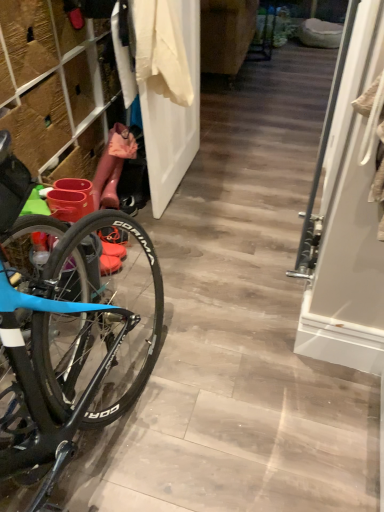
Question: Is white glossy screen door at right at the right side of rubber boots at left?

Choices:
 (A) yes
 (B) no

Answer: (A)

Question: Is white glossy screen door at right far away from rubber boots at left?

Choices:
 (A) no
 (B) yes

Answer: (B)

Question: Considering the relative sizes of white glossy screen door at right and rubber boots at left in the image provided, is white glossy screen door at right thinner than rubber boots at left?

Choices:
 (A) yes
 (B) no

Answer: (A)

Question: Is rubber boots at left at the back of white glossy screen door at right?

Choices:
 (A) no
 (B) yes

Answer: (A)

Question: Does white glossy screen door at right turn towards rubber boots at left?

Choices:
 (A) no
 (B) yes

Answer: (B)

Question: Is the depth of white glossy screen door at right less than that of rubber boots at left?

Choices:
 (A) yes
 (B) no

Answer: (A)

Question: From the image's perspective, is white matte door at center on rubber boots at left?

Choices:
 (A) yes
 (B) no

Answer: (A)

Question: Is white matte door at center bigger than rubber boots at left?

Choices:
 (A) no
 (B) yes

Answer: (A)

Question: Considering the relative sizes of white matte door at center and rubber boots at left in the image provided, is white matte door at center smaller than rubber boots at left?

Choices:
 (A) no
 (B) yes

Answer: (B)

Question: Considering the relative positions of white matte door at center and rubber boots at left in the image provided, is white matte door at center to the left of rubber boots at left from the viewer's perspective?

Choices:
 (A) yes
 (B) no

Answer: (B)

Question: Is white matte door at center further to camera compared to rubber boots at left?

Choices:
 (A) yes
 (B) no

Answer: (A)

Question: Is white matte door at center positioned far away from rubber boots at left?

Choices:
 (A) yes
 (B) no

Answer: (B)

Question: Does white matte door at center have a greater height compared to white cotton shirt at upper center?

Choices:
 (A) yes
 (B) no

Answer: (A)